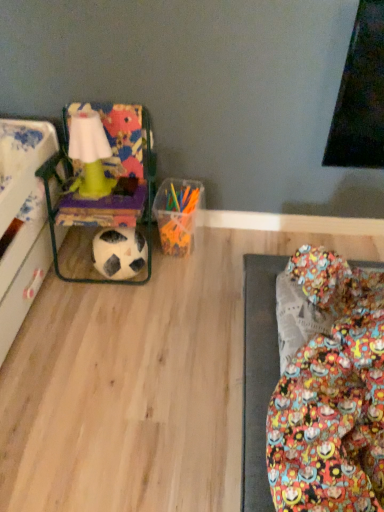
The height and width of the screenshot is (512, 384). I want to click on vacant region in front of black matte football at lower left, so click(x=121, y=310).